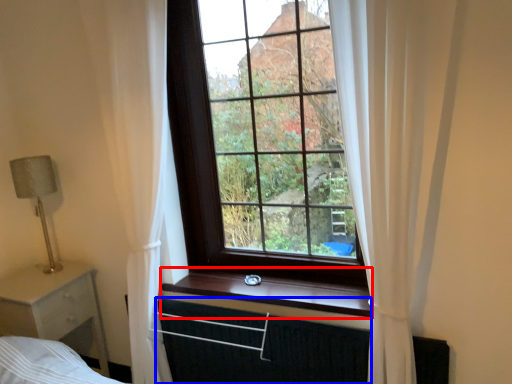
Question: Which object is further to the camera taking this photo, window sill (highlighted by a red box) or canopy bed (highlighted by a blue box)?

Choices:
 (A) window sill
 (B) canopy bed

Answer: (A)